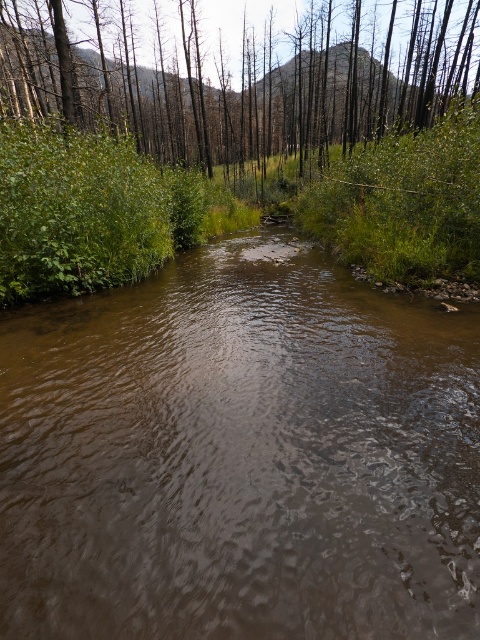
You are a hiker who wants to cross the brown smooth stream at center. You notice the green matte tree at upper center above you. Which direction should you look to find the tree relative to the stream?

The green matte tree at upper center is located above the brown smooth stream at center, so you should look upwards to find the tree relative to the stream.

You are standing at the center of the image and want to cross the stream. Is the brown smooth stream at center directly in front of you, or to one side?

The brown smooth stream at center is located at point [240,458], which is slightly to the right of the exact center. Therefore, it is positioned to your right side rather than directly in front.

You are standing at the edge of the forest and want to cross the brown smooth stream at center. If your walking pace is 3 feet per second, how many seconds will it take you to cross the stream?

The distance of brown smooth stream at center from viewer is 8.08 feet. To cross the stream, you need to cover 8.08 feet at a pace of 3 feet per second, which would take approximately 2.69 seconds.